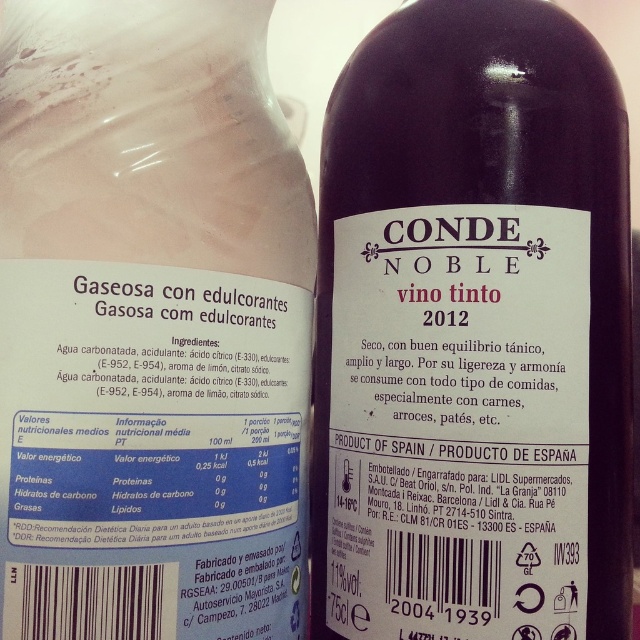
Question: From the image, what is the correct spatial relationship of dark glass bottle at center in relation to pink matte bottle at center?

Choices:
 (A) left
 (B) right

Answer: (B)

Question: Among these objects, which one is farthest from the camera?

Choices:
 (A) dark glass bottle at center
 (B) pink matte bottle at center

Answer: (A)

Question: Is dark glass bottle at center to the left of pink matte bottle at center from the viewer's perspective?

Choices:
 (A) yes
 (B) no

Answer: (B)

Question: Does dark glass bottle at center appear under pink matte bottle at center?

Choices:
 (A) no
 (B) yes

Answer: (B)

Question: Which of the following is the farthest from the observer?

Choices:
 (A) (122, 234)
 (B) (552, 380)

Answer: (B)

Question: Which object is closer to the camera taking this photo?

Choices:
 (A) pink matte bottle at center
 (B) dark glass bottle at center

Answer: (A)